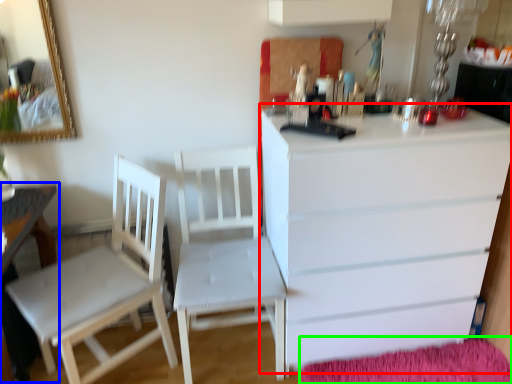
Question: Estimate the real-world distances between objects in this image. Which object is closer to chest of drawers (highlighted by a red box), table (highlighted by a blue box) or mat (highlighted by a green box)?

Choices:
 (A) table
 (B) mat

Answer: (B)